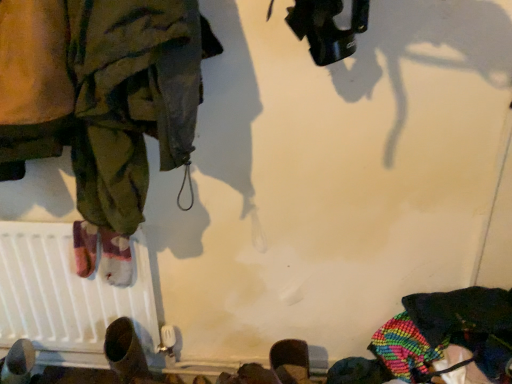
Question: Does brown leather shoe at lower left turn towards white matte radiator at lower left?

Choices:
 (A) yes
 (B) no

Answer: (B)

Question: Is brown leather shoe at lower left outside of white matte radiator at lower left?

Choices:
 (A) yes
 (B) no

Answer: (A)

Question: Is brown leather shoe at lower left further to camera compared to white matte radiator at lower left?

Choices:
 (A) no
 (B) yes

Answer: (A)

Question: From a real-world perspective, is brown leather shoe at lower left over white matte radiator at lower left?

Choices:
 (A) no
 (B) yes

Answer: (A)

Question: From a real-world perspective, is brown leather shoe at lower left below white matte radiator at lower left?

Choices:
 (A) no
 (B) yes

Answer: (B)

Question: Can you confirm if brown leather shoe at lower left is bigger than white matte radiator at lower left?

Choices:
 (A) no
 (B) yes

Answer: (A)

Question: Are brown leather shoe at lower left and camouflage fabric pants at left far apart?

Choices:
 (A) yes
 (B) no

Answer: (B)

Question: From the image's perspective, is brown leather shoe at lower left over camouflage fabric pants at left?

Choices:
 (A) no
 (B) yes

Answer: (A)

Question: Considering the relative positions of brown leather shoe at lower left and camouflage fabric pants at left in the image provided, is brown leather shoe at lower left to the right of camouflage fabric pants at left from the viewer's perspective?

Choices:
 (A) no
 (B) yes

Answer: (A)

Question: Is brown leather shoe at lower left aimed at camouflage fabric pants at left?

Choices:
 (A) no
 (B) yes

Answer: (A)

Question: Is the depth of brown leather shoe at lower left greater than that of camouflage fabric pants at left?

Choices:
 (A) no
 (B) yes

Answer: (B)

Question: Is brown leather shoe at lower left in front of camouflage fabric pants at left?

Choices:
 (A) no
 (B) yes

Answer: (A)

Question: Are white matte radiator at lower left and camouflage fabric pants at left making contact?

Choices:
 (A) yes
 (B) no

Answer: (B)